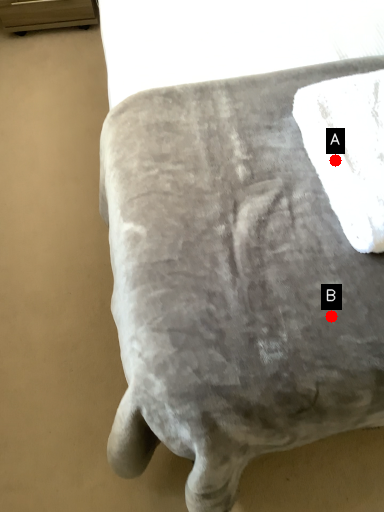
Question: Two points are circled on the image, labeled by A and B beside each circle. Which point is closer to the camera?

Choices:
 (A) A is closer
 (B) B is closer

Answer: (B)